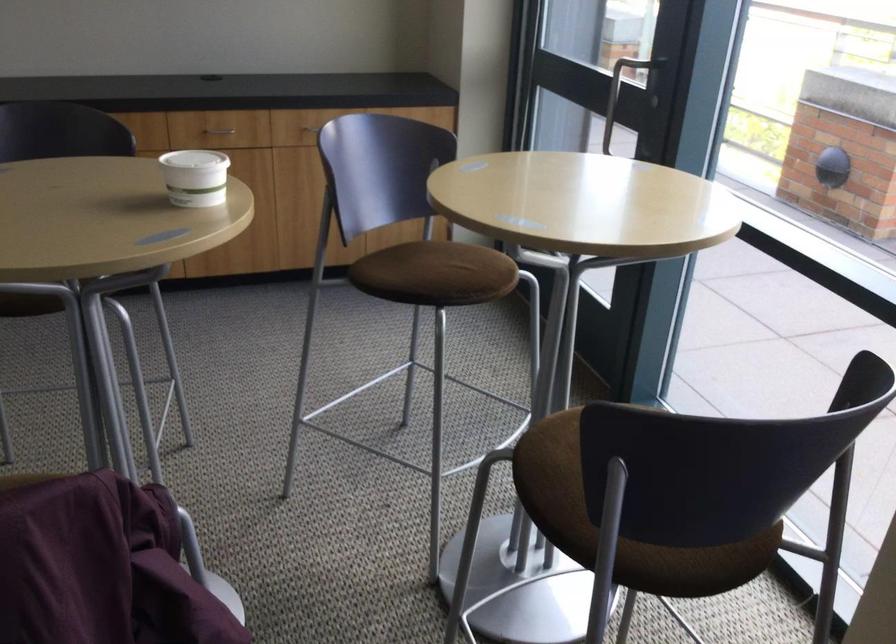
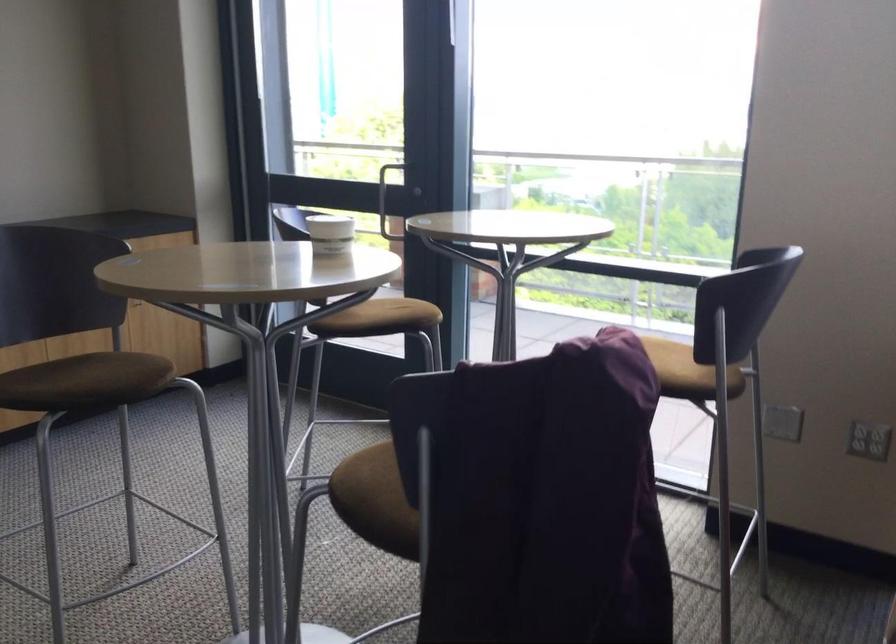
In the second image, find the point that corresponds to (x=183, y=178) in the first image.

(330, 234)